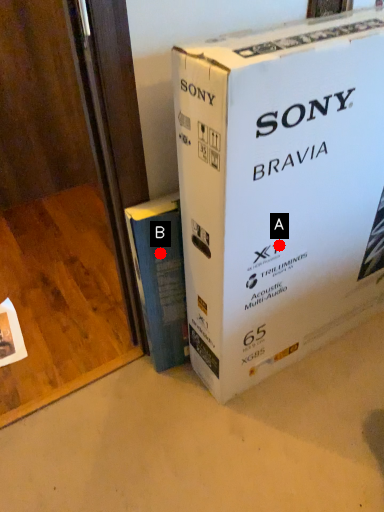
Question: Two points are circled on the image, labeled by A and B beside each circle. Among these points, which one is nearest to the camera?

Choices:
 (A) A is closer
 (B) B is closer

Answer: (A)